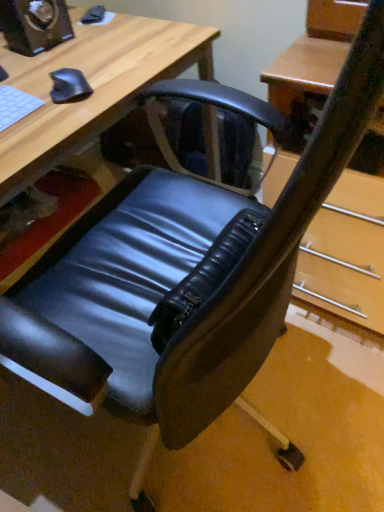
Question: Is matte black chair at lower left facing away from white matte keyboard at upper left?

Choices:
 (A) yes
 (B) no

Answer: (B)

Question: Is matte black chair at lower left taller than white matte keyboard at upper left?

Choices:
 (A) no
 (B) yes

Answer: (B)

Question: Could you tell me if matte black chair at lower left is turned towards white matte keyboard at upper left?

Choices:
 (A) yes
 (B) no

Answer: (B)

Question: From a real-world perspective, is matte black chair at lower left on top of white matte keyboard at upper left?

Choices:
 (A) no
 (B) yes

Answer: (A)

Question: Is matte black chair at lower left thinner than white matte keyboard at upper left?

Choices:
 (A) yes
 (B) no

Answer: (B)

Question: Based on their positions, is white matte keyboard at upper left located to the left or right of matte black speaker at upper left?

Choices:
 (A) left
 (B) right

Answer: (A)

Question: From a real-world perspective, is white matte keyboard at upper left physically located above or below matte black speaker at upper left?

Choices:
 (A) below
 (B) above

Answer: (A)

Question: Choose the correct answer: Is white matte keyboard at upper left inside matte black speaker at upper left or outside it?

Choices:
 (A) outside
 (B) inside

Answer: (A)

Question: Considering the positions of white matte keyboard at upper left and matte black speaker at upper left in the image, is white matte keyboard at upper left wider or thinner than matte black speaker at upper left?

Choices:
 (A) wide
 (B) thin

Answer: (B)

Question: In the image, is black matte mouse at upper left positioned in front of or behind matte black speaker at upper left?

Choices:
 (A) behind
 (B) front

Answer: (B)

Question: From a real-world perspective, relative to matte black speaker at upper left, is black matte mouse at upper left vertically above or below?

Choices:
 (A) above
 (B) below

Answer: (B)

Question: Is black matte mouse at upper left bigger or smaller than matte black speaker at upper left?

Choices:
 (A) big
 (B) small

Answer: (B)

Question: Is black matte mouse at upper left to the left or to the right of matte black speaker at upper left in the image?

Choices:
 (A) left
 (B) right

Answer: (B)

Question: Is matte black speaker at upper left bigger or smaller than black matte mouse at upper left?

Choices:
 (A) small
 (B) big

Answer: (B)

Question: From a real-world perspective, is matte black speaker at upper left above or below black matte mouse at upper left?

Choices:
 (A) below
 (B) above

Answer: (B)